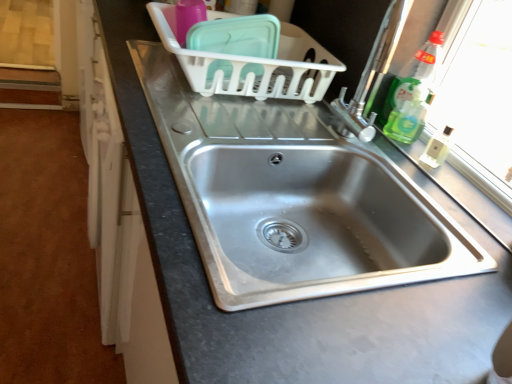
This screenshot has width=512, height=384. Find the location of `free space below satin nickel faucet at right (from a real-world perspective)`. free space below satin nickel faucet at right (from a real-world perspective) is located at coordinates (343, 140).